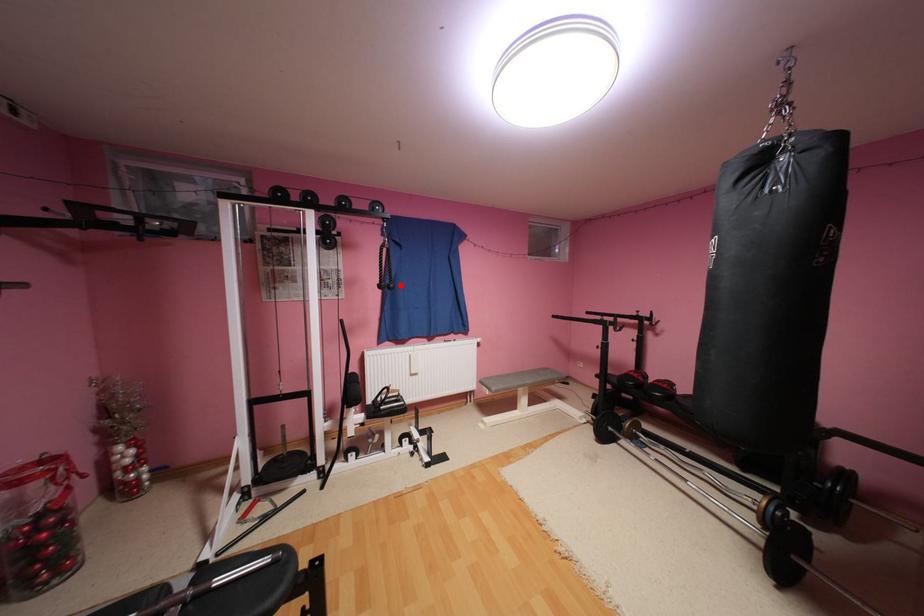
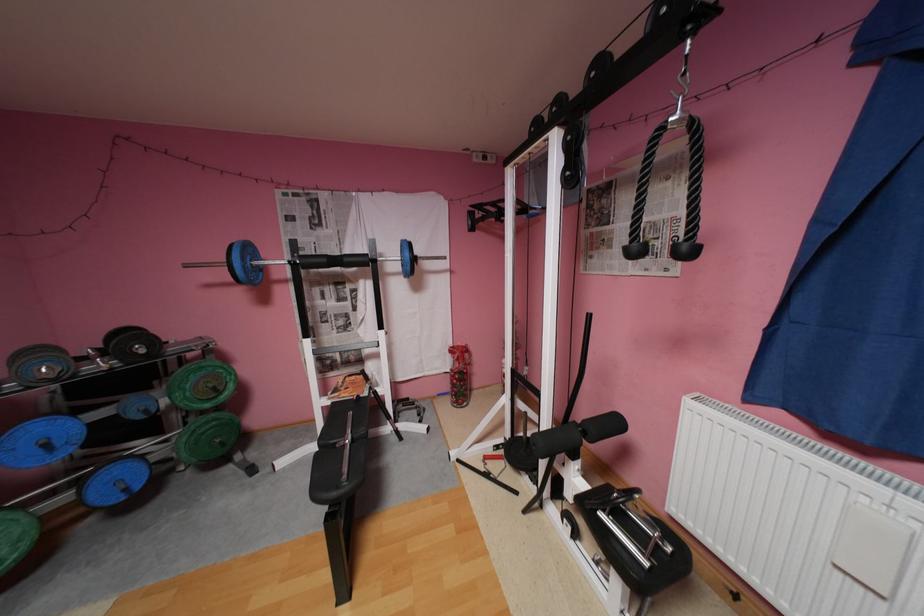
Question: I am providing you with two images of the same scene from different viewpoints. In image1, a red point is highlighted. Considering the same 3D point in image2, which of the following is correct?

Choices:
 (A) It is closer
 (B) It is farther

Answer: (B)